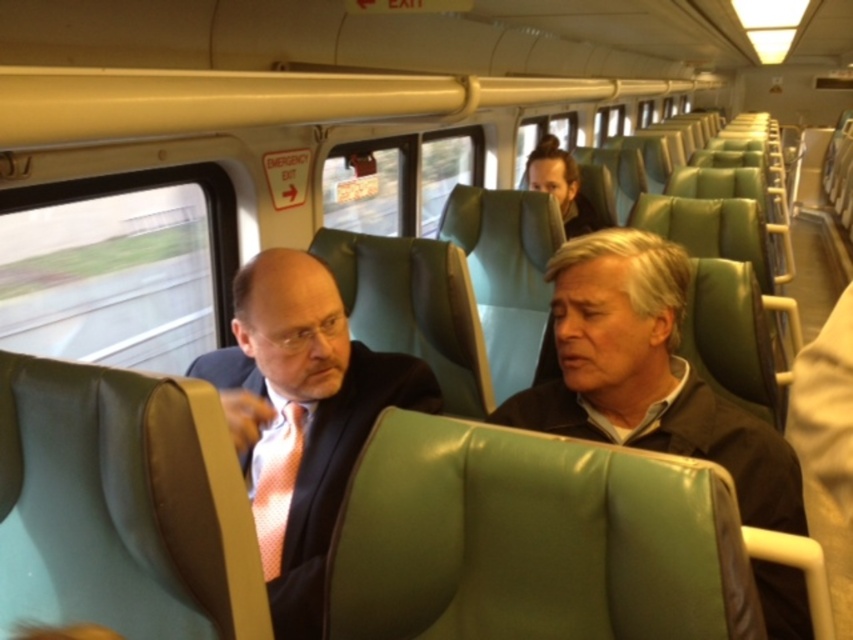
Is matte brown jacket at center thinner than pink dotted tie at center?

No, matte brown jacket at center is not thinner than pink dotted tie at center.

Does matte brown jacket at center have a greater width compared to pink dotted tie at center?

Yes, matte brown jacket at center is wider than pink dotted tie at center.

You are a GUI agent. You are given a task and a screenshot of the screen. Output one action in this format:
    pyautogui.click(x=<x>, y=<y>)
    Task: Click on the matte brown jacket at center
    
    Given the screenshot: What is the action you would take?
    pyautogui.click(x=647, y=372)

Who is lower down, matte brown jacket at center or matte black suit at center?

matte black suit at center is below.

Is matte brown jacket at center to the right of matte black suit at center from the viewer's perspective?

Yes, matte brown jacket at center is to the right of matte black suit at center.

Is point (659, 419) behind point (264, 346)?

No, (659, 419) is in front of (264, 346).

This screenshot has height=640, width=853. Find the location of `matte brown jacket at center`. matte brown jacket at center is located at coordinates pyautogui.click(x=647, y=372).

Which is more to the left, pink dotted tie at center or dark brown leather jacket at upper center?

pink dotted tie at center

Is point (277, 563) behind point (572, 236)?

No, it is not.

Where is `pink dotted tie at center`? The image size is (853, 640). pink dotted tie at center is located at coordinates (277, 488).